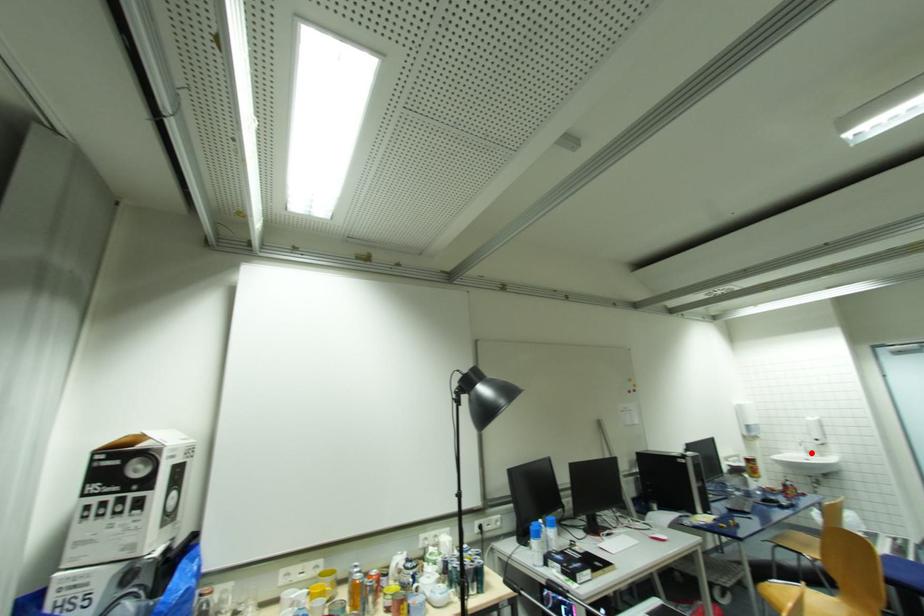
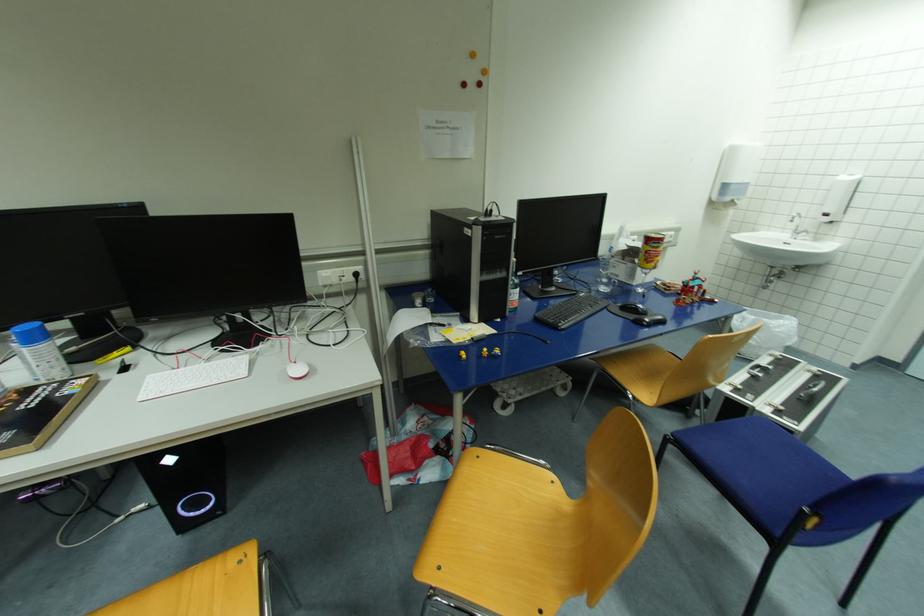
Question: I am providing you with two images of the same scene from different viewpoints. A red point is shown in image1. For the corresponding object point in image2, is it positioned nearer or farther from the camera?

Choices:
 (A) Nearer
 (B) Farther

Answer: (B)